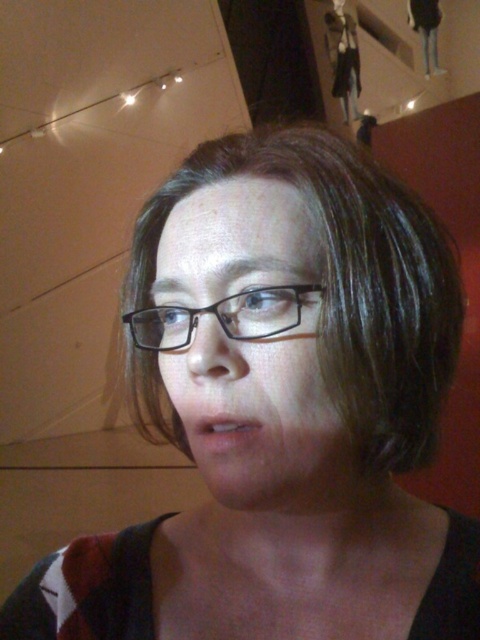
Question: Is matte black glasses at center to the right of black plastic glasses at center from the viewer's perspective?

Choices:
 (A) yes
 (B) no

Answer: (A)

Question: Which point is closer to the camera?

Choices:
 (A) black plastic glasses at center
 (B) matte black glasses at center

Answer: (B)

Question: Can you confirm if matte black glasses at center is thinner than black plastic glasses at center?

Choices:
 (A) no
 (B) yes

Answer: (A)

Question: Does matte black glasses at center appear under black plastic glasses at center?

Choices:
 (A) yes
 (B) no

Answer: (A)